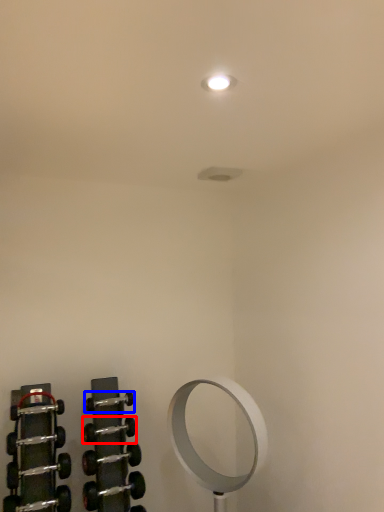
Question: Which of the following is the closest to the observer, dumbbell (highlighted by a red box) or dumbbell (highlighted by a blue box)?

Choices:
 (A) dumbbell
 (B) dumbbell

Answer: (A)